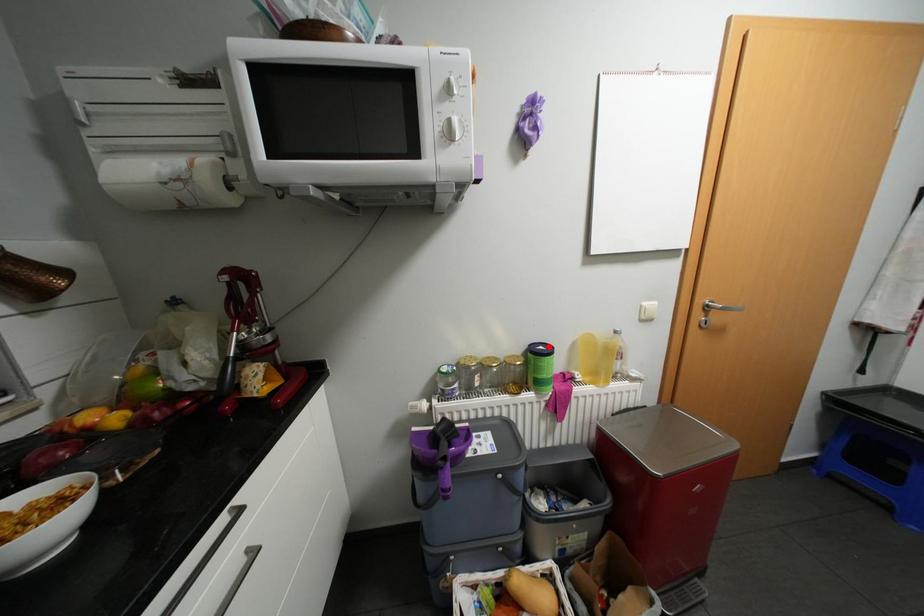
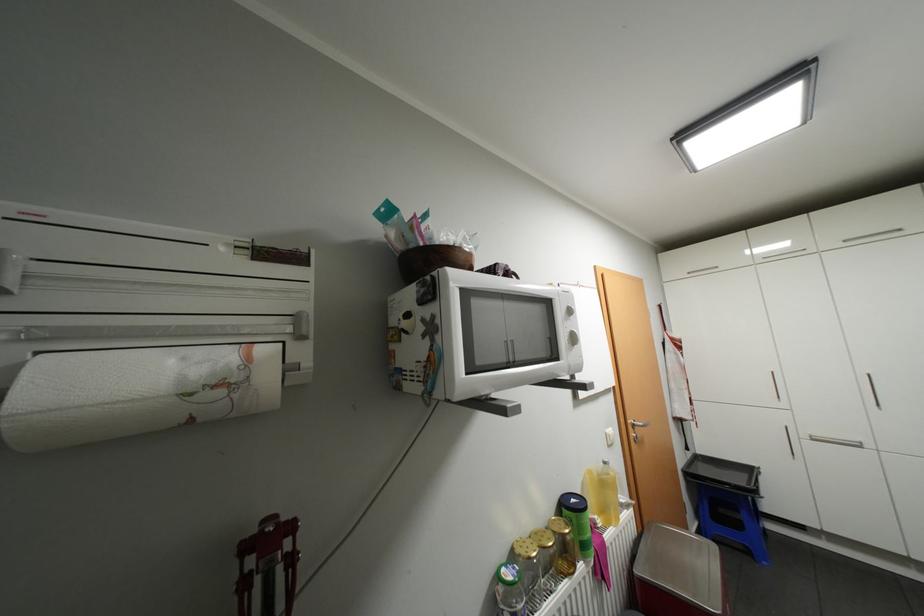
Where in the second image is the point corresponding to the highlighted location from the first image?

(580, 499)